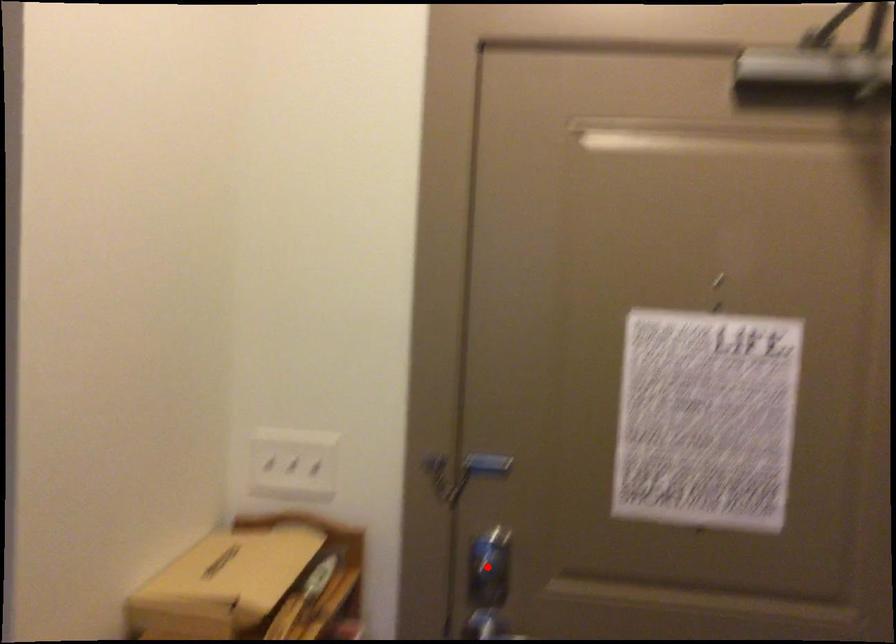
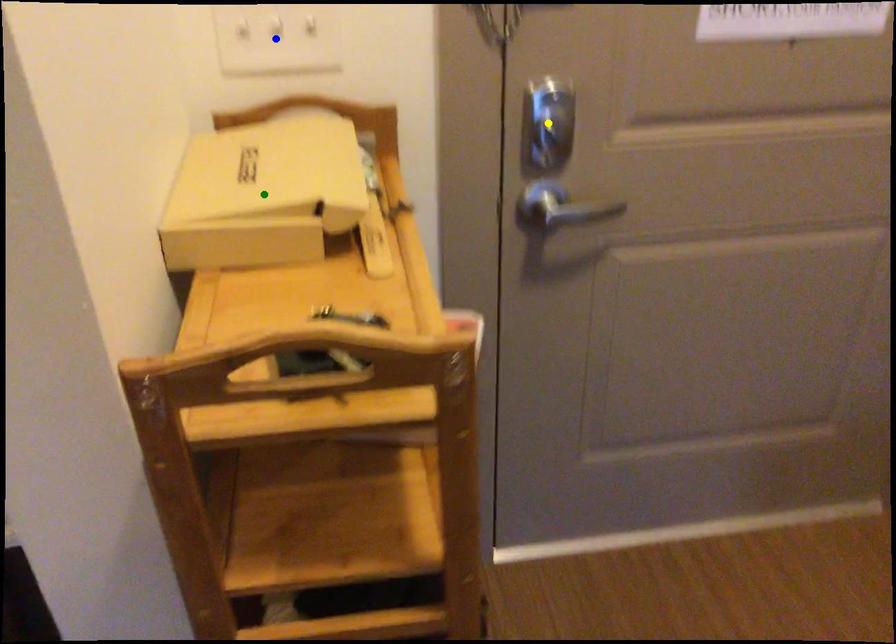
Question: I am providing you with two images of the same scene from different viewpoints. A red point is marked on the first image. You are given multiple points on the second image. Which spot in image 2 lines up with the point in image 1?

Choices:
 (A) yellow point
 (B) green point
 (C) blue point

Answer: (A)